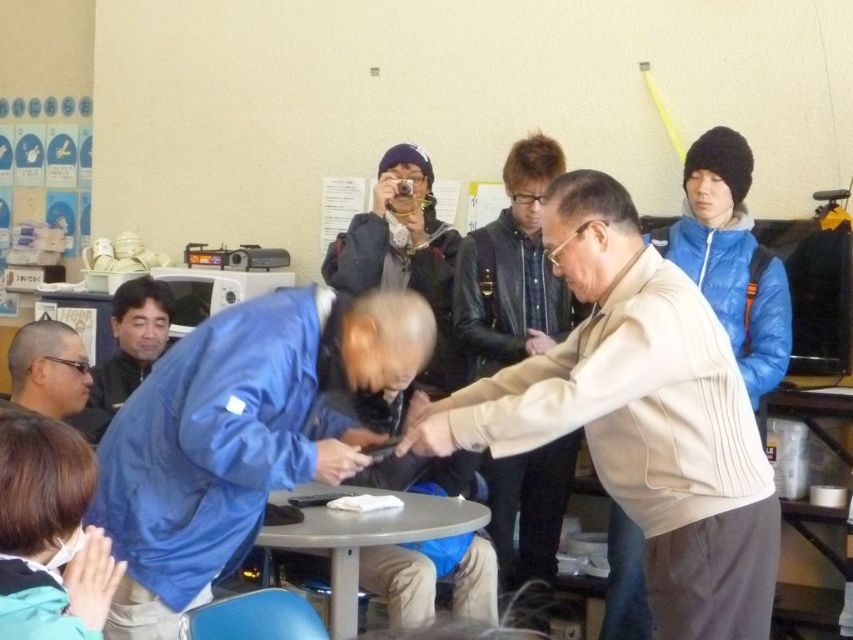
Question: Where is light beige sweater at center located in relation to matte blue glove at lower center in the image?

Choices:
 (A) left
 (B) right

Answer: (B)

Question: Observing the image, what is the correct spatial positioning of light beige sweater at center in reference to matte blue glove at lower center?

Choices:
 (A) above
 (B) below

Answer: (A)

Question: Estimate the real-world distances between objects in this image. Which object is farther from the gray plastic table at center?

Choices:
 (A) blue fabric jacket at lower left
 (B) blue fabric jacket at center
 (C) matte black hand at center
 (D) matte blue glove at lower center

Answer: (A)

Question: Among these points, which one is farthest from the camera?

Choices:
 (A) (268, 545)
 (B) (608, 356)
 (C) (137, 292)
 (D) (24, 371)

Answer: (C)

Question: Does blue fabric jacket at center have a lesser width compared to smooth blue fabric at lower left?

Choices:
 (A) no
 (B) yes

Answer: (A)

Question: Estimate the real-world distances between objects in this image. Which object is closer to the matte black hand at center?

Choices:
 (A) matte black glasses at lower left
 (B) gray plastic table at center
 (C) light beige sweater at center

Answer: (C)